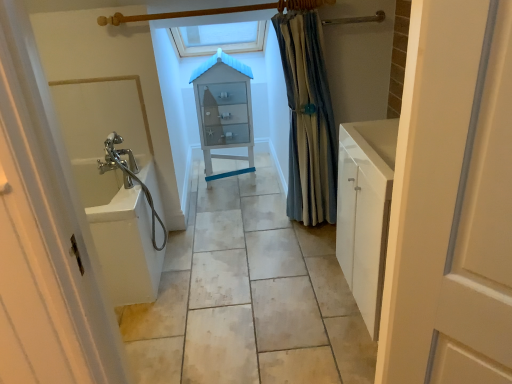
In order to click on vacant space positioned to the left of blue striped fabric at right in this screenshot , I will do `click(268, 230)`.